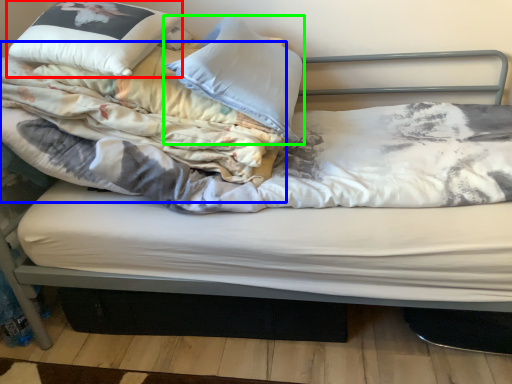
Question: Considering the real-world distances, which object is farthest from pillow (highlighted by a red box)? blanket (highlighted by a blue box) or pillow (highlighted by a green box)?

Choices:
 (A) blanket
 (B) pillow

Answer: (B)